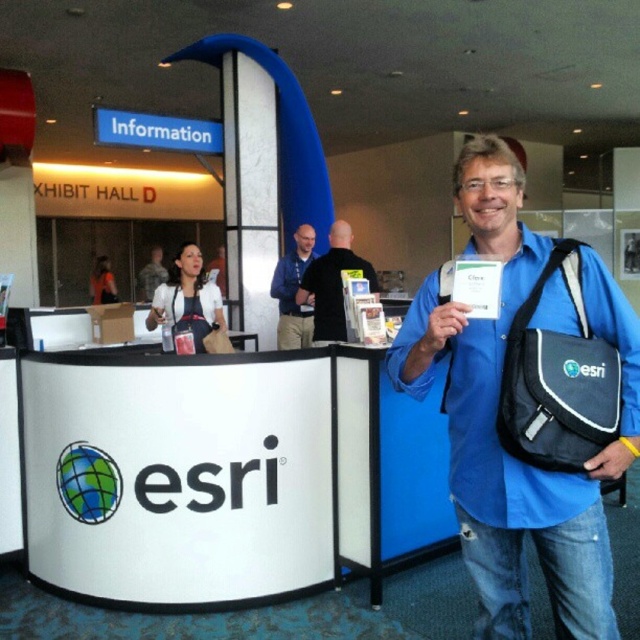
Question: Does blue shirt at center appear on the left side of camouflage uniform at center?

Choices:
 (A) yes
 (B) no

Answer: (B)

Question: Does blue fabric shirt at center appear under blue shirt at center?

Choices:
 (A) no
 (B) yes

Answer: (B)

Question: Which object is farther from the camera taking this photo?

Choices:
 (A) black matte shirt at center
 (B) blue fabric shirt at center
 (C) camouflage uniform at center

Answer: (C)

Question: Which point appears closest to the camera in this image?

Choices:
 (A) (420, 316)
 (B) (140, 282)
 (C) (316, 317)

Answer: (A)

Question: Observing the image, what is the correct spatial positioning of blue fabric shirt at center in reference to blue shirt at center?

Choices:
 (A) below
 (B) above

Answer: (A)

Question: Which object is positioned farthest from the blue fabric shirt at center?

Choices:
 (A) blue shirt at center
 (B) camouflage uniform at center

Answer: (B)